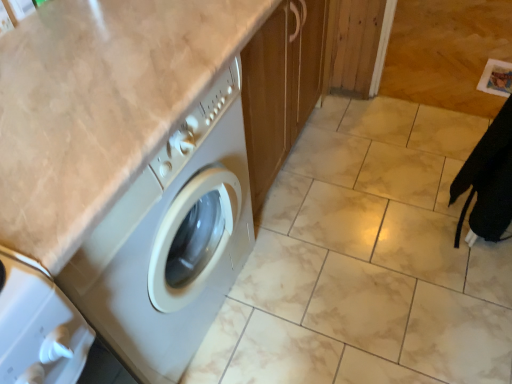
Identify the location of vacant area on top of marble tile at lower right (from a real-world perspective). [455, 38].